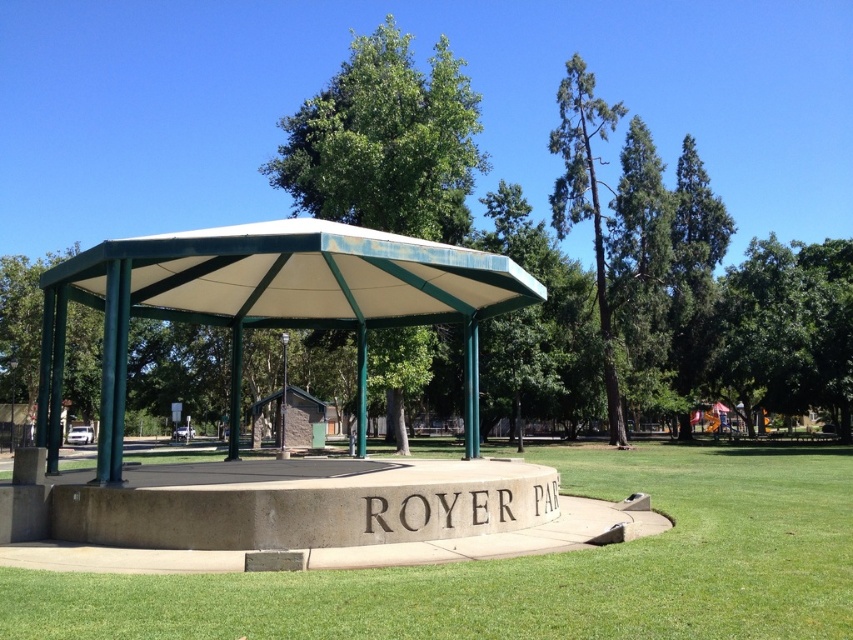
You are planning to set up a picnic blanket in the park. The green fabric canopy at center and the green leafy tree at center are both in your view. Which object would cast a smaller shadow at noon? Please explain your reasoning based on their physical characteristics.

The green fabric canopy at center is thinner than the green leafy tree at center. Since the canopy is thinner, it would cast a smaller shadow compared to the thicker tree, which likely has a broader and denser foliage, resulting in a larger shadow at noon.